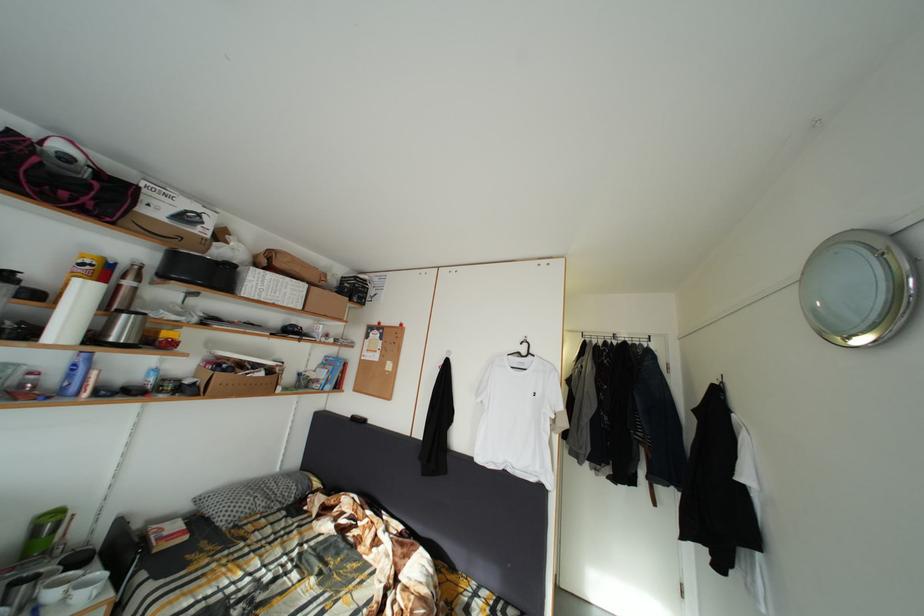
Where would you lift the black pot lid handle? Please return your answer as a coordinate pair (x, y).

(122, 329)